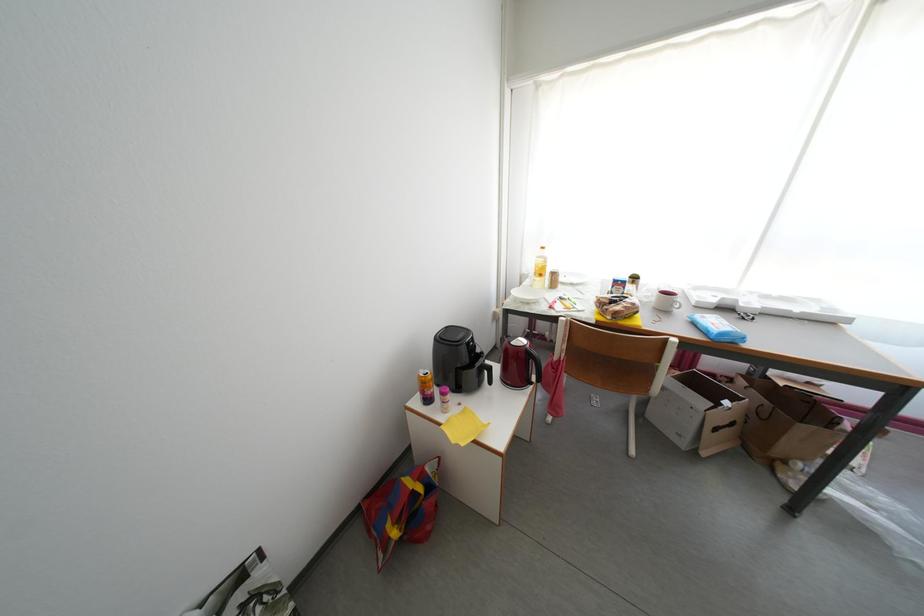
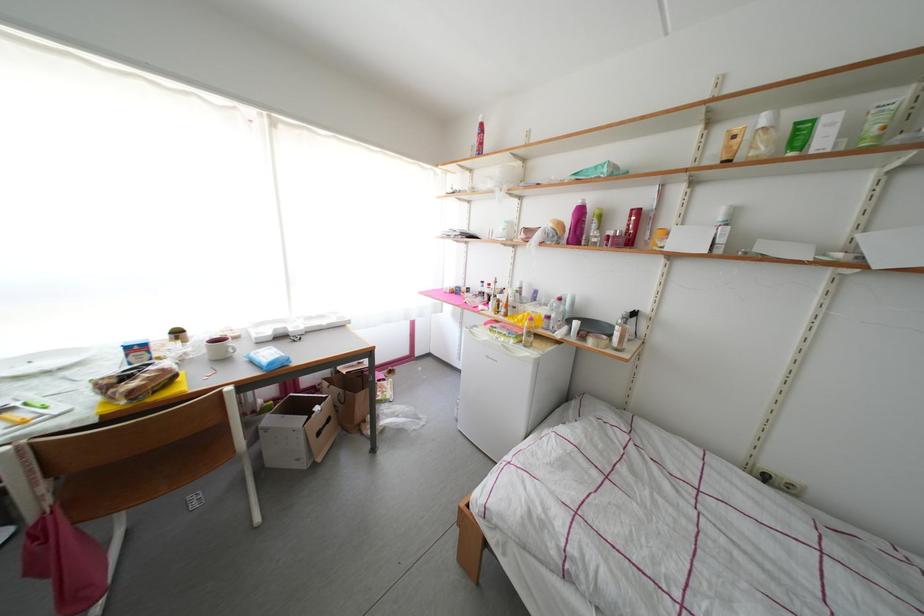
Question: The camera is either moving clockwise (left) or counter-clockwise (right) around the object. The first image is from the beginning of the video and the second image is from the end. Is the camera moving left or right when shooting the video?

Choices:
 (A) Left
 (B) Right

Answer: (A)